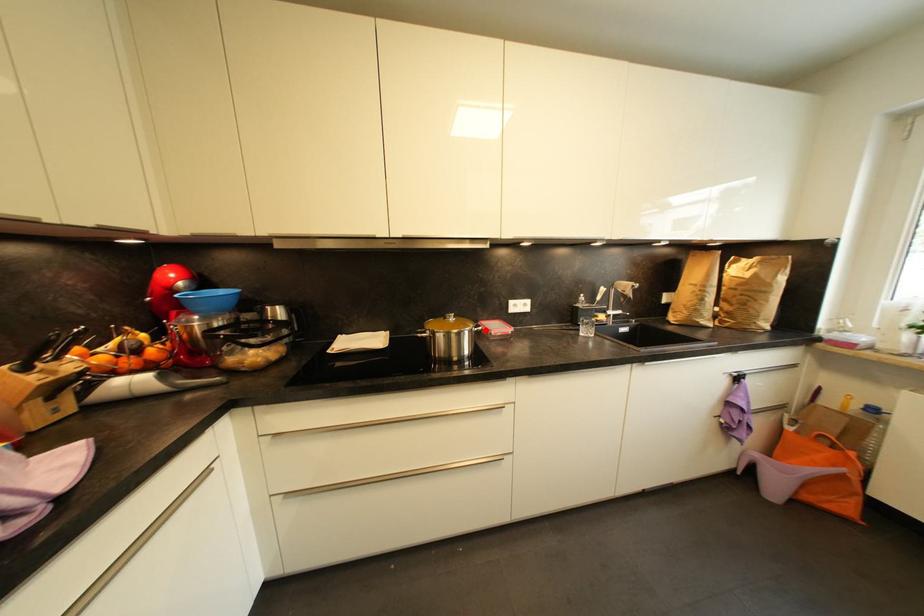
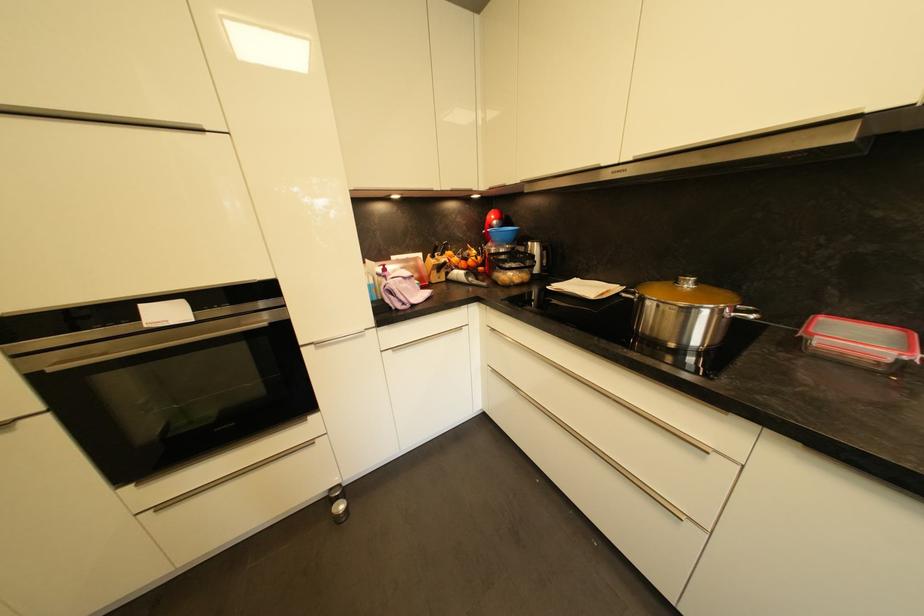
Locate, in the second image, the point that corresponds to the highlighted location in the first image.

(758, 318)